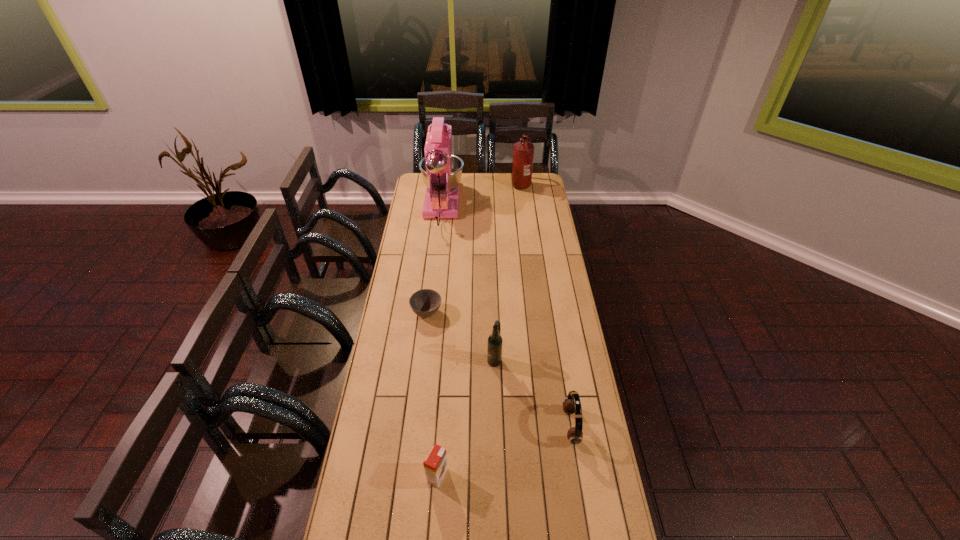
In the image, there is a desktop. Where is `vacant space at the far right corner`? Image resolution: width=960 pixels, height=540 pixels. vacant space at the far right corner is located at coordinates (533, 179).

Locate an element on the screen. The width and height of the screenshot is (960, 540). vacant area that lies between the tallest object and the shortest object is located at coordinates (434, 261).

At what (x,y) coordinates should I click in order to perform the action: click on free spot between the fourth object from left to right and the nearest object. Please return your answer as a coordinate pair (x, y). Looking at the image, I should click on (466, 417).

Identify the location of vacant space that's between the fourth farthest object and the second nearest object. This screenshot has height=540, width=960. (533, 393).

Where is `free space between the nearest object and the headset`? This screenshot has height=540, width=960. free space between the nearest object and the headset is located at coordinates (504, 451).

The image size is (960, 540). I want to click on vacant space in between the tallest object and the fire extinguisher, so click(481, 196).

Locate an element on the screen. The height and width of the screenshot is (540, 960). vacant space that's between the fire extinguisher and the fourth farthest object is located at coordinates (508, 272).

Find the location of a particular element. unoccupied area between the mixer and the fire extinguisher is located at coordinates (481, 196).

You are a GUI agent. You are given a task and a screenshot of the screen. Output one action in this format:
    pyautogui.click(x=<x>, y=<y>)
    Task: Click on the free space between the nearest object and the fourth farthest object
    The width and height of the screenshot is (960, 540).
    Given the screenshot: What is the action you would take?
    pyautogui.click(x=466, y=417)

Identify the location of the fifth closest object to the headset. The height and width of the screenshot is (540, 960). (523, 152).